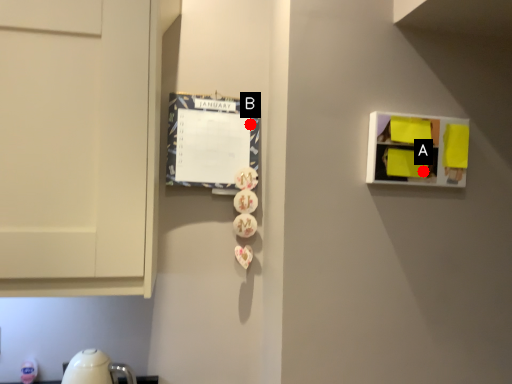
Question: Two points are circled on the image, labeled by A and B beside each circle. Among these points, which one is nearest to the camera?

Choices:
 (A) A is closer
 (B) B is closer

Answer: (A)